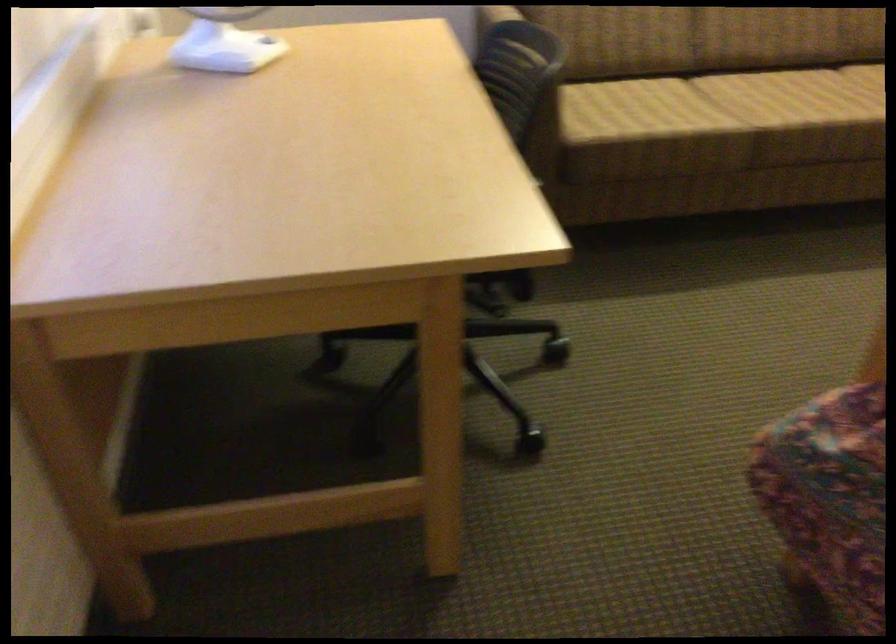
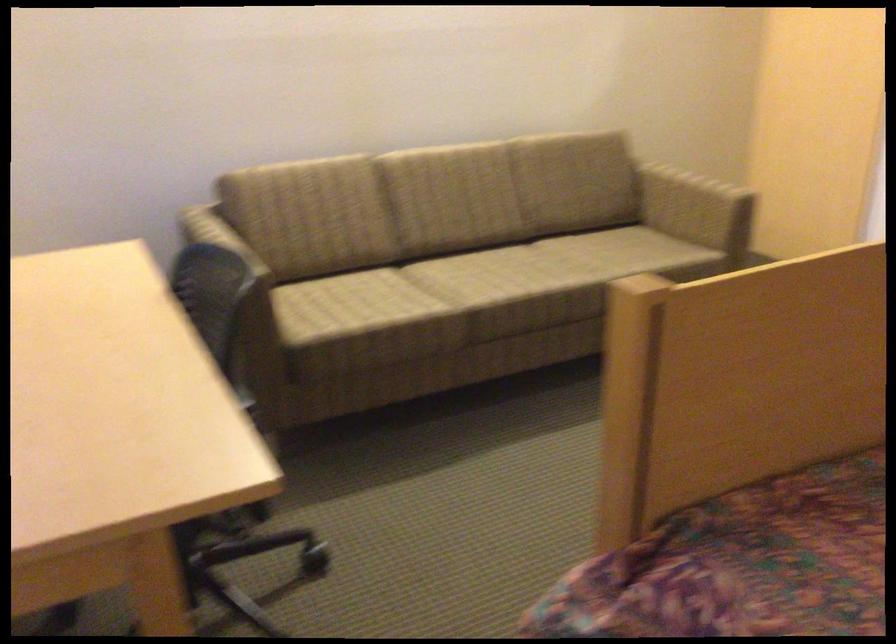
Where in the second image is the point corresponding to point (762, 100) from the first image?

(470, 279)